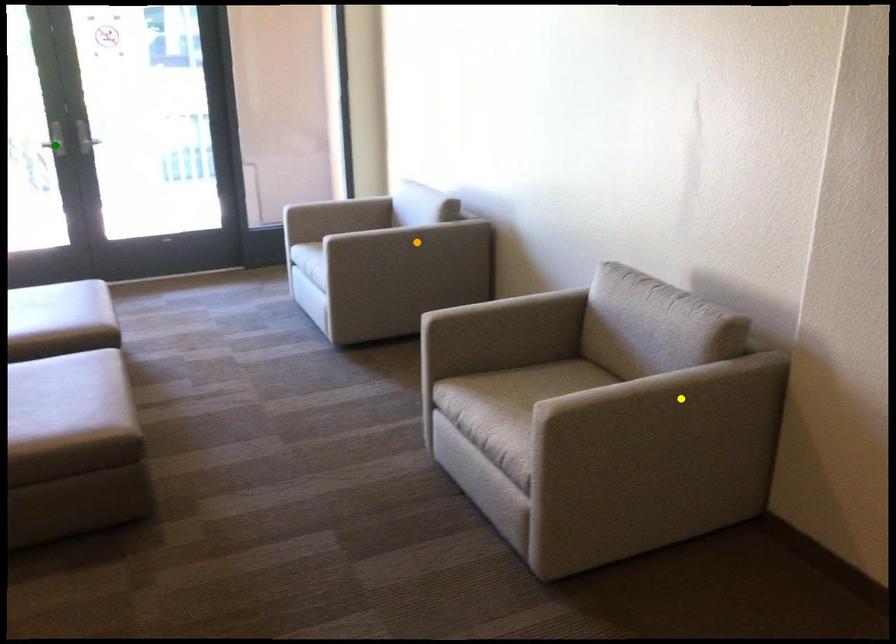
Order these from nearest to farthest:
- yellow point
- green point
- orange point

yellow point → orange point → green point